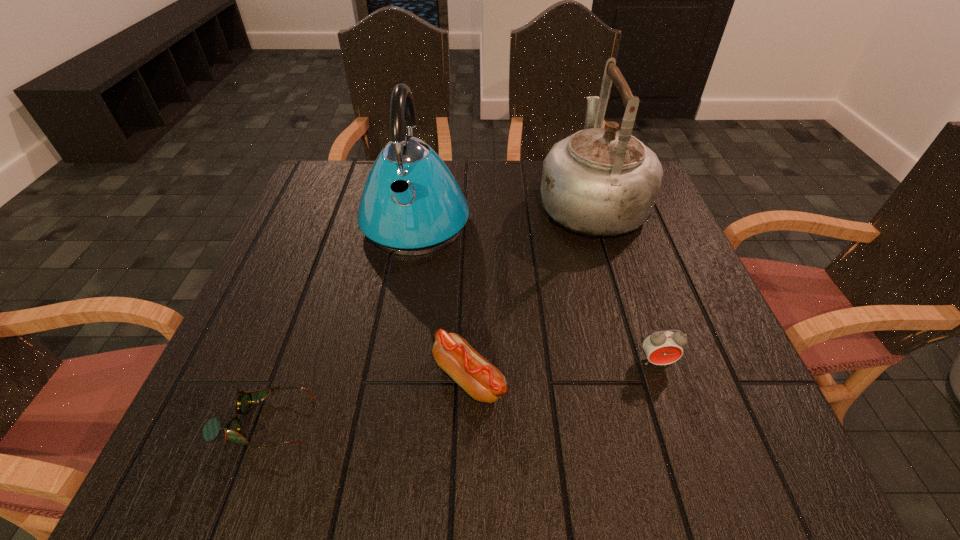
Where is `vacant region between the right kettle and the spectacles`? vacant region between the right kettle and the spectacles is located at coordinates (427, 312).

Image resolution: width=960 pixels, height=540 pixels. In order to click on free space between the left kettle and the spectacles in this screenshot , I will do `click(340, 322)`.

Locate an element on the screen. Image resolution: width=960 pixels, height=540 pixels. vacant point located between the shortest object and the fourth tallest object is located at coordinates (366, 400).

I want to click on free spot between the second shortest object and the right kettle, so (530, 290).

Where is `empty space between the spectacles and the third tallest object`? The width and height of the screenshot is (960, 540). empty space between the spectacles and the third tallest object is located at coordinates (460, 392).

Where is `vacant space in between the spectacles and the sausage`? The image size is (960, 540). vacant space in between the spectacles and the sausage is located at coordinates (366, 400).

You are a GUI agent. You are given a task and a screenshot of the screen. Output one action in this format:
    pyautogui.click(x=<x>, y=<y>)
    Task: Click on the blank region between the sausage and the left kettle
    This screenshot has width=960, height=540.
    Given the screenshot: What is the action you would take?
    pyautogui.click(x=443, y=300)

Locate an element on the screen. Image resolution: width=960 pixels, height=540 pixels. vacant area between the spectacles and the right kettle is located at coordinates (427, 312).

At what (x,y) coordinates should I click in order to perform the action: click on free spot between the fourth tallest object and the left kettle. Please return your answer as a coordinate pair (x, y). The width and height of the screenshot is (960, 540). Looking at the image, I should click on (443, 300).

The image size is (960, 540). What are the coordinates of `free area in between the sausage and the spectacles` in the screenshot? It's located at (366, 400).